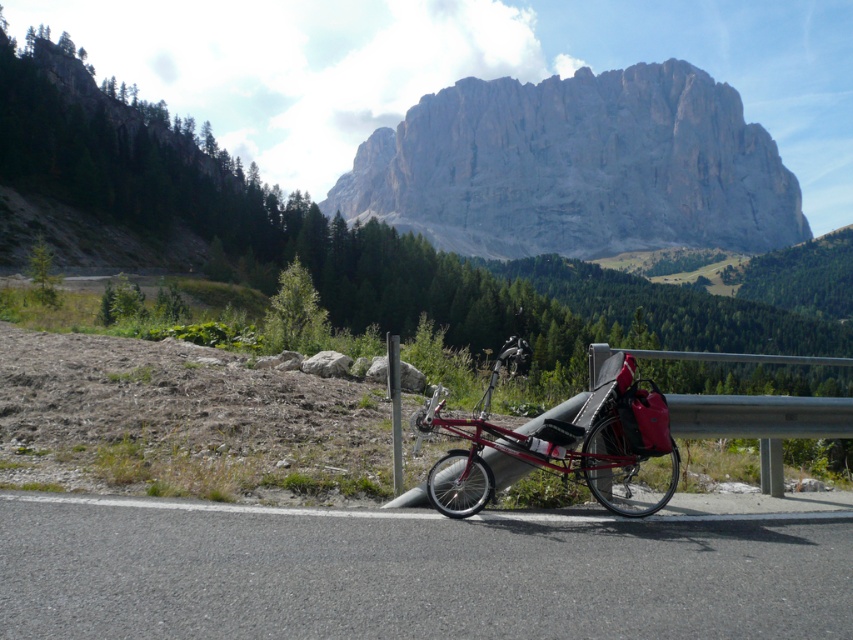
You are standing at the mountain base and want to reach the highest point in the image. You have two options to choose from, either going towards point [12,600] or point [498,125]. Which path would be shorter in distance?

Point [12,600] is closer to the viewer than point [498,125], so the path to point [12,600] would be shorter in distance.

You are planning a hiking trip and want to know if the gray rocky mountain at upper center is a good landmark to follow. Considering their sizes, will the metallic red bicycle at center be visible from the top of the mountain?

The gray rocky mountain at upper center has a larger size compared to metallic red bicycle at center, so the bicycle might be too small to see from the mountain top unless it is very close.

You are a hiker planning to take a photo of the gray rocky mountain at upper center. You want to include the black asphalt road at lower center in your shot. Based on their positions, which object will appear closer to the bottom of your photo?

The black asphalt road at lower center will appear closer to the bottom of your photo because it is positioned below the gray rocky mountain at upper center.